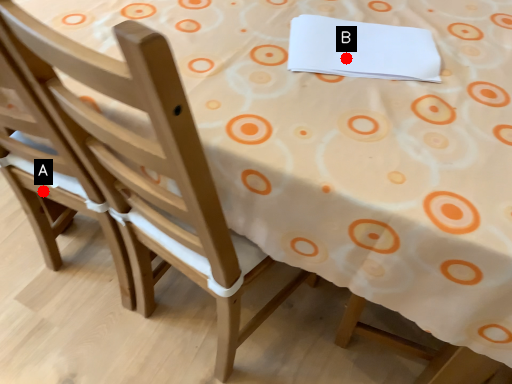
Question: Two points are circled on the image, labeled by A and B beside each circle. Which point is further to the camera?

Choices:
 (A) A is further
 (B) B is further

Answer: (A)